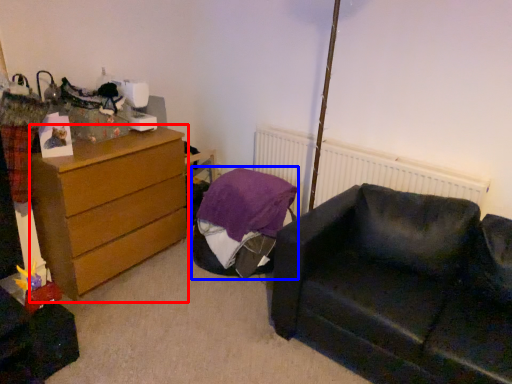
Question: Which of the following is the farthest to the observer, chest of drawers (highlighted by a red box) or bean bag chair (highlighted by a blue box)?

Choices:
 (A) chest of drawers
 (B) bean bag chair

Answer: (B)